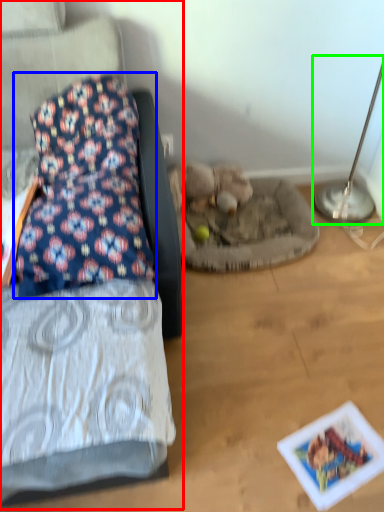
Question: Which object is the closest to the furniture (highlighted by a red box)? Choose among these: pillow (highlighted by a blue box) or table lamp (highlighted by a green box).

Choices:
 (A) pillow
 (B) table lamp

Answer: (A)